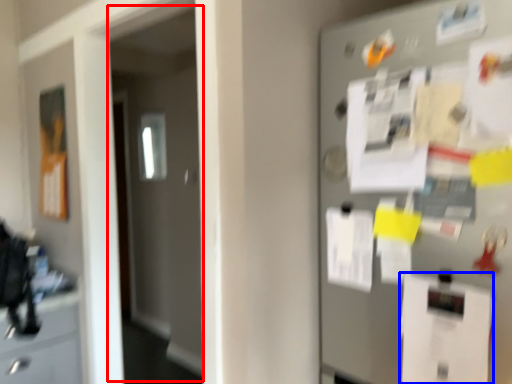
Question: Which of the following is the farthest to the observer, glass door (highlighted by a red box) or paper (highlighted by a blue box)?

Choices:
 (A) glass door
 (B) paper

Answer: (A)